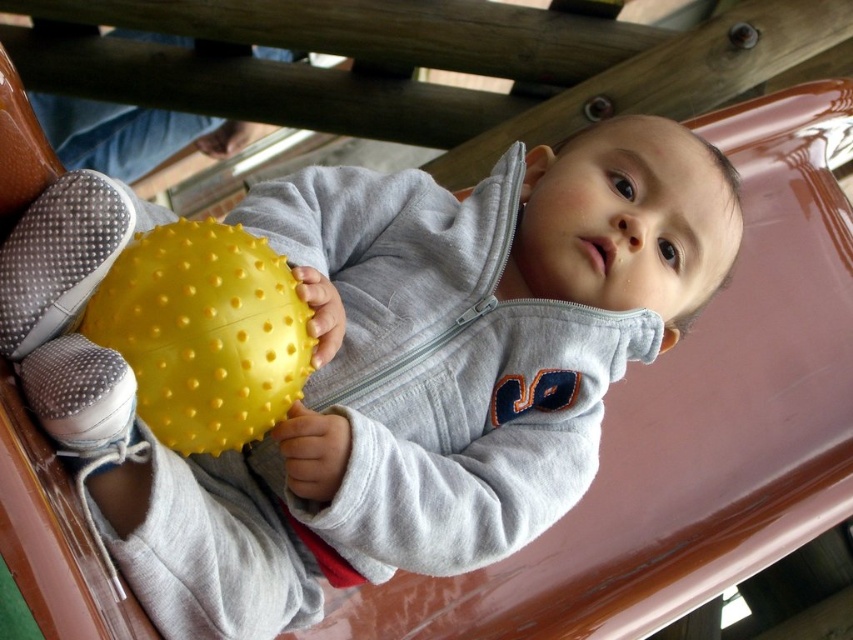
Question: Is matte yellow ball at center above yellow rubber ball at center?

Choices:
 (A) no
 (B) yes

Answer: (A)

Question: Which of the following is the closest to the observer?

Choices:
 (A) (59, 189)
 (B) (90, 316)

Answer: (A)

Question: Is matte yellow ball at center further to the viewer compared to yellow rubber ball at center?

Choices:
 (A) yes
 (B) no

Answer: (B)

Question: Which point is closer to the camera?

Choices:
 (A) matte yellow ball at center
 (B) yellow rubber ball at center

Answer: (A)

Question: Does matte yellow ball at center have a greater width compared to yellow rubber ball at center?

Choices:
 (A) yes
 (B) no

Answer: (A)